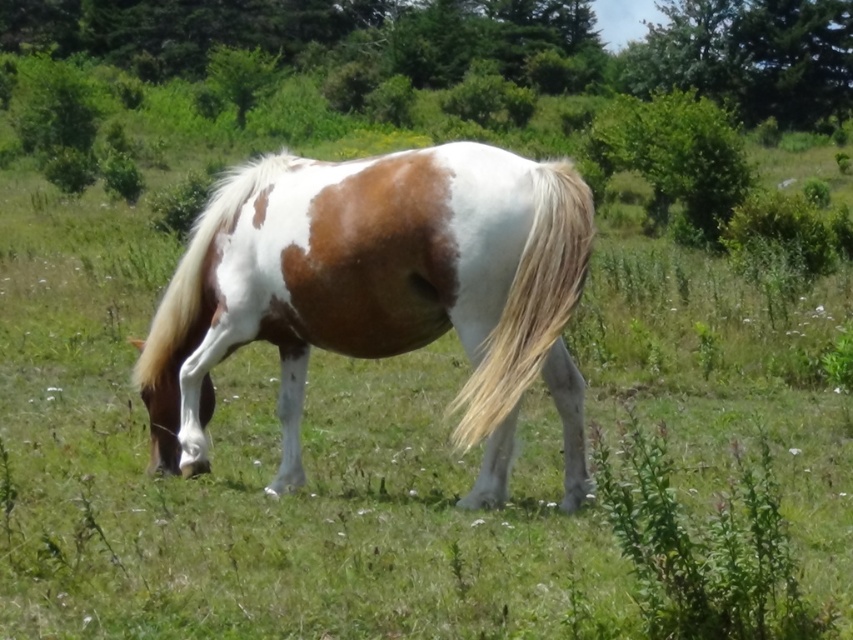
Question: Which of the following is the closest to the observer?

Choices:
 (A) white silky mane at center
 (B) blonde silky tail at center
 (C) white and brown speckled horse at center

Answer: (B)

Question: Which object appears closest to the camera in this image?

Choices:
 (A) blonde silky tail at center
 (B) white and brown speckled horse at center

Answer: (A)

Question: Which of the following is the closest to the observer?

Choices:
 (A) (489, 429)
 (B) (300, 204)
 (C) (258, 176)

Answer: (A)

Question: Can you confirm if blonde silky tail at center is smaller than white silky mane at center?

Choices:
 (A) no
 (B) yes

Answer: (B)

Question: Is white and brown speckled horse at center smaller than white silky mane at center?

Choices:
 (A) no
 (B) yes

Answer: (B)

Question: Does white and brown speckled horse at center have a greater width compared to blonde silky tail at center?

Choices:
 (A) no
 (B) yes

Answer: (B)